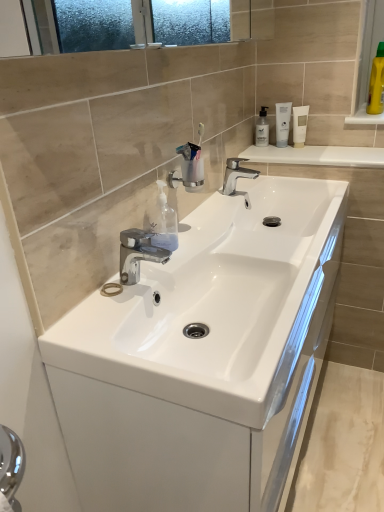
At what (x,y) coordinates should I click in order to perform the action: click on vacant area that is in front of white matte tube at upper right, the second mouthwash from the right. Please return your answer as a coordinate pair (x, y). The width and height of the screenshot is (384, 512). Looking at the image, I should click on (313, 156).